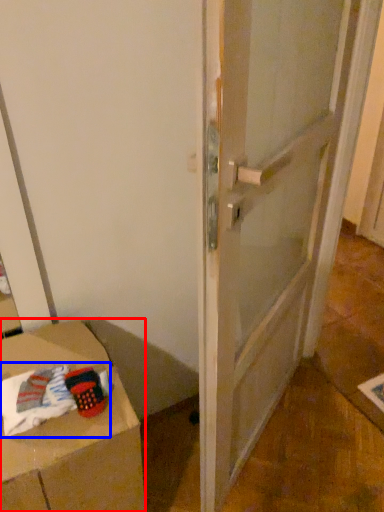
Question: Which object is closer to the camera taking this photo, furniture (highlighted by a red box) or laundry (highlighted by a blue box)?

Choices:
 (A) furniture
 (B) laundry

Answer: (A)